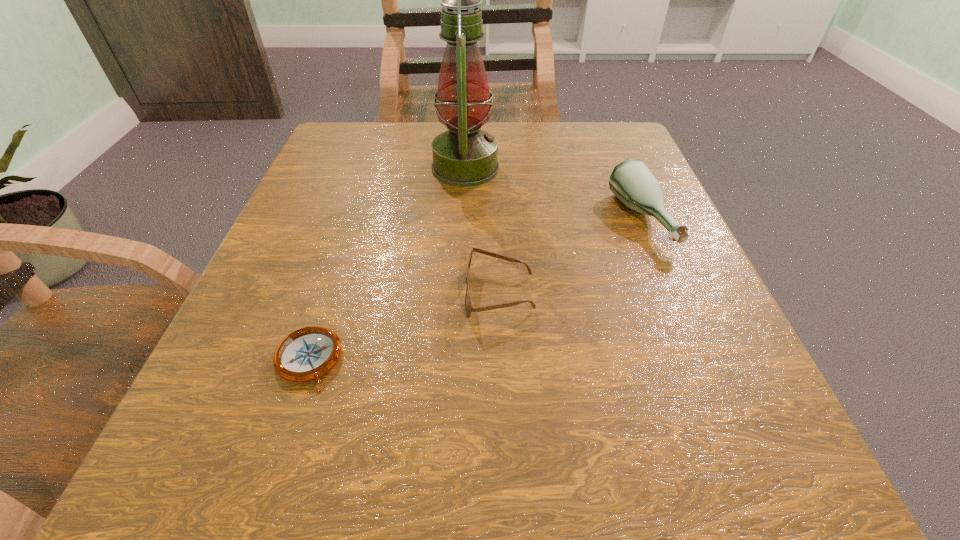
Locate an element on the screen. The image size is (960, 540). the tallest object is located at coordinates (464, 156).

You are a GUI agent. You are given a task and a screenshot of the screen. Output one action in this format:
    pyautogui.click(x=<x>, y=<y>)
    Task: Click on the third shortest object
    The width and height of the screenshot is (960, 540).
    Given the screenshot: What is the action you would take?
    pyautogui.click(x=631, y=181)

This screenshot has height=540, width=960. I want to click on bottle, so pyautogui.click(x=631, y=181).

Identify the location of the third tallest object. The image size is (960, 540). (469, 308).

Where is `sunglasses`? sunglasses is located at coordinates (469, 308).

Where is `the nearest object`? The height and width of the screenshot is (540, 960). the nearest object is located at coordinates (306, 354).

This screenshot has width=960, height=540. Find the location of `the shortest object`. the shortest object is located at coordinates (306, 354).

This screenshot has height=540, width=960. Find the location of `vacant space located 0.260m on the right of the oil lamp`. vacant space located 0.260m on the right of the oil lamp is located at coordinates (629, 168).

You are a GUI agent. You are given a task and a screenshot of the screen. Output one action in this format:
    pyautogui.click(x=<x>, y=<y>)
    Task: Click on the vacant area situated on the front of the bottle
    
    Given the screenshot: What is the action you would take?
    pyautogui.click(x=690, y=343)

This screenshot has width=960, height=540. Identify the location of vacant region located 0.270m on the frames of the third farthest object. (280, 294).